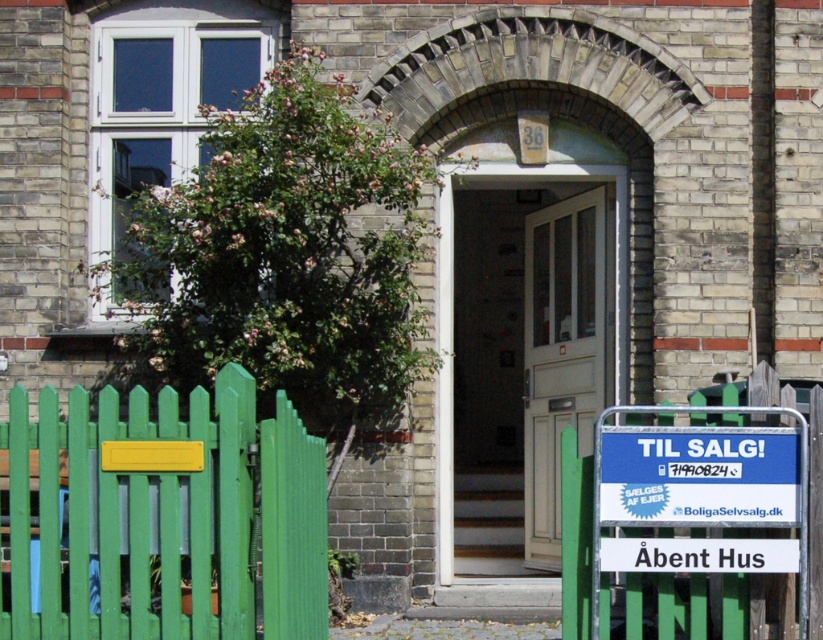
Is point (608, 436) behind point (447, 413)?

No, (608, 436) is in front of (447, 413).

At what (x,y) coordinates should I click in order to perform the action: click on green wooden fence at lower center. Please return your answer as a coordinate pair (x, y). Looking at the image, I should click on (691, 502).

I want to click on white glass door at center, so click(x=559, y=355).

Can you confirm if white glass door at center is wider than blue plastic sign at center?

Incorrect, white glass door at center's width does not surpass blue plastic sign at center's.

What do you see at coordinates (559, 355) in the screenshot?
I see `white glass door at center` at bounding box center [559, 355].

The image size is (823, 640). I want to click on white glass door at center, so click(x=559, y=355).

Does green wooden fence at lower left have a larger size compared to green wooden fence at lower center?

Correct, green wooden fence at lower left is larger in size than green wooden fence at lower center.

Does green wooden fence at lower left come behind green wooden fence at lower center?

No, it is not.

Measure the distance between point (107, 545) and camera.

6.05 meters

Where is `green wooden fence at lower left`? This screenshot has width=823, height=640. green wooden fence at lower left is located at coordinates (161, 515).